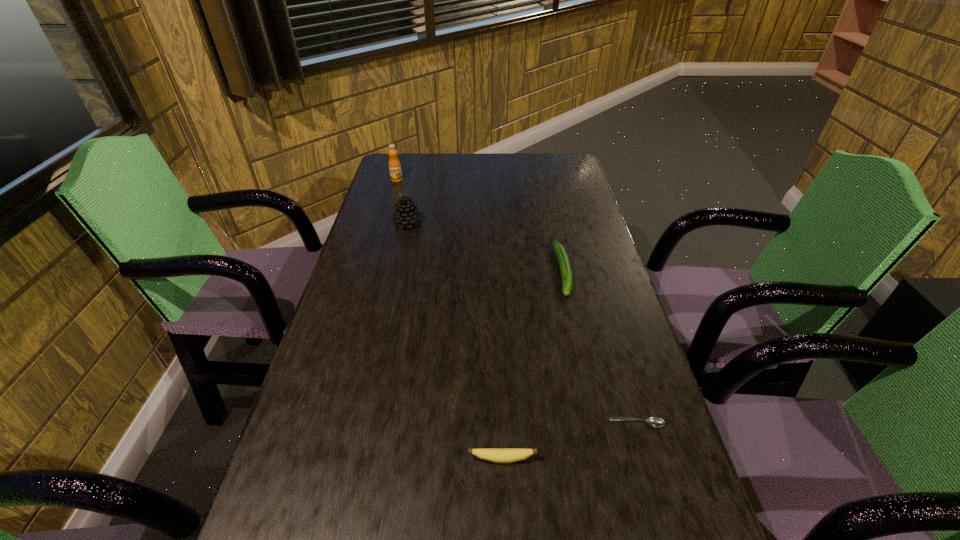
Identify the location of vacant space located on the front label of the leftmost object. This screenshot has width=960, height=540. (380, 236).

The image size is (960, 540). I want to click on blank area located 0.210m at the narrow end of the fourth object from right to left, so click(x=486, y=223).

This screenshot has height=540, width=960. What are the coordinates of `free space located 0.370m on the back of the banana` in the screenshot? It's located at (496, 315).

What are the coordinates of `free space located 0.270m on the front-facing side of the third nearest object` in the screenshot? It's located at (588, 386).

Identify the location of free space located on the left of the soupspoon. The image size is (960, 540). (477, 423).

Locate an element on the screen. The width and height of the screenshot is (960, 540). object that is positioned at the far edge is located at coordinates (394, 164).

What are the coordinates of `orange juice present at the left edge` in the screenshot? It's located at (394, 164).

Find the location of a particular element. This screenshot has height=540, width=960. pinecone located in the left edge section of the desktop is located at coordinates (406, 214).

Locate an element on the screen. Image resolution: width=960 pixels, height=540 pixels. zucchini present at the right edge is located at coordinates (566, 272).

The width and height of the screenshot is (960, 540). In order to click on soupspoon located in the right edge section of the desktop in this screenshot , I will do `click(656, 422)`.